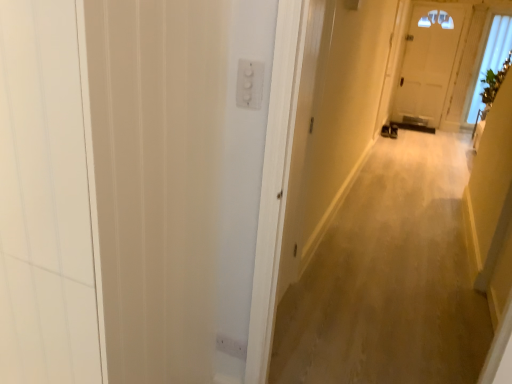
Find the location of a particular element. The image size is (512, 384). beige carpet at center is located at coordinates (390, 278).

Find the location of `white plastic switch at upper center`. white plastic switch at upper center is located at coordinates (250, 84).

Which is more to the right, beige carpet at center or transparent glass window at upper right?

transparent glass window at upper right.

From the image's perspective, is beige carpet at center above or below transparent glass window at upper right?

From the image's perspective, beige carpet at center appears below transparent glass window at upper right.

Is beige carpet at center positioned beyond the bounds of transparent glass window at upper right?

Absolutely, beige carpet at center is external to transparent glass window at upper right.

Where is `corridor that appears below the transparent glass window at upper right (from the image's perspective)`? corridor that appears below the transparent glass window at upper right (from the image's perspective) is located at coordinates (390, 278).

Is transparent glass window at upper right completely or partially outside of beige carpet at center?

That's correct, transparent glass window at upper right is outside of beige carpet at center.

Which object is wider, transparent glass window at upper right or beige carpet at center?

With larger width is beige carpet at center.

How far apart are transparent glass window at upper right and beige carpet at center?

transparent glass window at upper right and beige carpet at center are 3.78 meters apart.

Is transparent glass window at upper right far from beige carpet at center?

transparent glass window at upper right is far away from beige carpet at center.

Is white plastic switch at upper center turned away from transparent glass window at upper right?

Yes, white plastic switch at upper center is facing away from transparent glass window at upper right.

Is point (241, 91) farther from camera compared to point (481, 63)?

No, (241, 91) is closer to viewer.

Find the location of a particular element. This screenshot has height=384, width=512. electric outlet in front of the transparent glass window at upper right is located at coordinates (250, 84).

Can you confirm if white plastic switch at upper center is wider than transparent glass window at upper right?

Incorrect, the width of white plastic switch at upper center does not surpass that of transparent glass window at upper right.

Is white plastic switch at upper center to the left or to the right of beige carpet at center in the image?

Based on their positions, white plastic switch at upper center is located to the left of beige carpet at center.

Does white plastic switch at upper center have a greater height compared to beige carpet at center?

Correct, white plastic switch at upper center is much taller as beige carpet at center.

Between white plastic switch at upper center and beige carpet at center, which one has smaller width?

Thinner between the two is white plastic switch at upper center.

Considering the sizes of objects white plastic switch at upper center and beige carpet at center in the image provided, who is smaller, white plastic switch at upper center or beige carpet at center?

Smaller between the two is white plastic switch at upper center.

Is white wood screen door at left with beige carpet at center?

No.

Is white wood screen door at left positioned with its back to beige carpet at center?

Yes, white wood screen door at left is facing away from beige carpet at center.

Is white wood screen door at left taller or shorter than beige carpet at center?

In the image, white wood screen door at left appears to be taller than beige carpet at center.

Does transparent glass window at upper right have a greater width compared to white wood screen door at left?

No.

The image size is (512, 384). What are the coordinates of `screen door below the transparent glass window at upper right (from a real-world perspective)` in the screenshot? It's located at (176, 180).

Considering their positions, is transparent glass window at upper right located in front of or behind white wood screen door at left?

transparent glass window at upper right is behind white wood screen door at left.

From the image's perspective, is white wood screen door at left positioned above or below white plastic switch at upper center?

white wood screen door at left is below white plastic switch at upper center.

Is white wood screen door at left shorter than white plastic switch at upper center?

Incorrect, the height of white wood screen door at left does not fall short of that of white plastic switch at upper center.

In terms of size, does white wood screen door at left appear bigger or smaller than white plastic switch at upper center?

white wood screen door at left is bigger than white plastic switch at upper center.

Is white wood screen door at left facing towards white plastic switch at upper center?

No, white wood screen door at left does not turn towards white plastic switch at upper center.

At what (x,y) coordinates should I click in order to perform the action: click on window behind the beige carpet at center. Please return your answer as a coordinate pair (x, y). The width and height of the screenshot is (512, 384). Looking at the image, I should click on (490, 60).

Identify the location of corridor below the transparent glass window at upper right (from the image's perspective). The width and height of the screenshot is (512, 384). (390, 278).

Estimate the real-world distances between objects in this image. Which object is further from white wood screen door at left, beige carpet at center or transparent glass window at upper right?

transparent glass window at upper right.

Estimate the real-world distances between objects in this image. Which object is closer to beige carpet at center, transparent glass window at upper right or white wood screen door at left?

white wood screen door at left is closer to beige carpet at center.

When comparing their distances from beige carpet at center, does white plastic switch at upper center or white wood screen door at left seem further?

Among the two, white plastic switch at upper center is located further to beige carpet at center.

Considering their positions, is transparent glass window at upper right positioned closer to white plastic switch at upper center than white wood screen door at left?

Among the two, white wood screen door at left is located nearer to white plastic switch at upper center.

Looking at this image, estimate the real-world distances between objects in this image. Which object is closer to beige carpet at center, transparent glass window at upper right or white plastic switch at upper center?

white plastic switch at upper center lies closer to beige carpet at center than the other object.

Estimate the real-world distances between objects in this image. Which object is closer to beige carpet at center, white wood screen door at left or white plastic switch at upper center?

white wood screen door at left lies closer to beige carpet at center than the other object.

Estimate the real-world distances between objects in this image. Which object is closer to transparent glass window at upper right, white wood screen door at left or white plastic switch at upper center?

Based on the image, white plastic switch at upper center appears to be nearer to transparent glass window at upper right.

Which object lies nearer to the anchor point transparent glass window at upper right, beige carpet at center or white wood screen door at left?

Based on the image, beige carpet at center appears to be nearer to transparent glass window at upper right.

At what (x,y) coordinates should I click in order to perform the action: click on corridor positioned between white plastic switch at upper center and transparent glass window at upper right from near to far. Please return your answer as a coordinate pair (x, y). Image resolution: width=512 pixels, height=384 pixels. Looking at the image, I should click on (390, 278).

Where is `corridor between white wood screen door at left and transparent glass window at upper right along the z-axis`? This screenshot has height=384, width=512. corridor between white wood screen door at left and transparent glass window at upper right along the z-axis is located at coordinates (390, 278).

Where is `electric outlet between white wood screen door at left and beige carpet at center from left to right`? electric outlet between white wood screen door at left and beige carpet at center from left to right is located at coordinates (250, 84).

Find the location of a particular element. The width and height of the screenshot is (512, 384). electric outlet positioned between white wood screen door at left and transparent glass window at upper right from near to far is located at coordinates (250, 84).